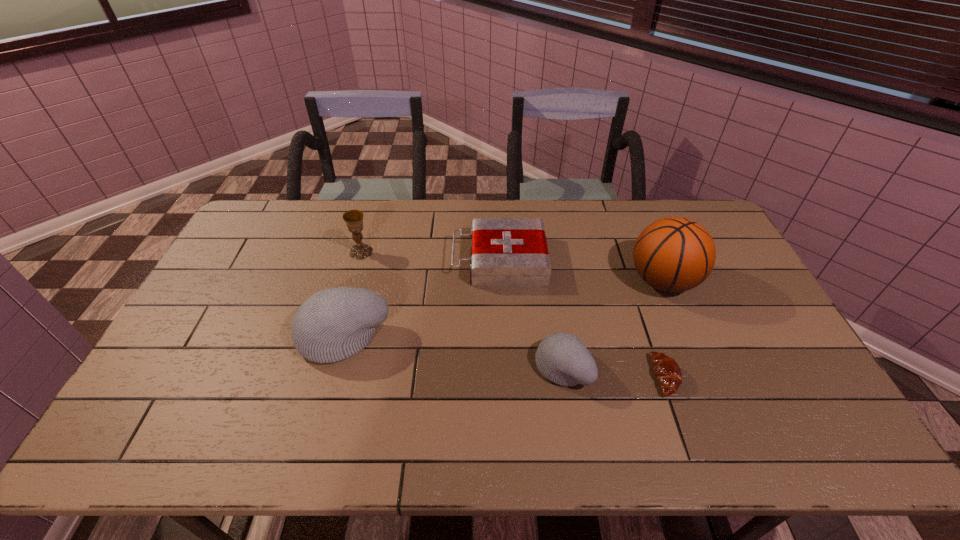
At what (x,y) coordinates should I click in order to perform the action: click on vacant space that's between the chalice and the second shortest object. Please return your answer as a coordinate pair (x, y). This screenshot has height=540, width=960. Looking at the image, I should click on 430,256.

What are the coordinates of `empty space between the taller beanie and the third shortest object` in the screenshot? It's located at (453, 351).

Where is `vacant point located between the second shortest object and the crescent roll`? This screenshot has height=540, width=960. vacant point located between the second shortest object and the crescent roll is located at coordinates (x=583, y=318).

Where is `vacant area that lies between the basketball and the left beanie`? Image resolution: width=960 pixels, height=540 pixels. vacant area that lies between the basketball and the left beanie is located at coordinates (503, 308).

I want to click on free space between the first-aid kit and the crescent roll, so click(x=583, y=318).

Where is `object that stands as the closest to the chalice`? object that stands as the closest to the chalice is located at coordinates (333, 324).

Locate which object is the second closest to the tallest object. Please provide its 2D coordinates. Your answer should be formatted as a tuple, i.e. [(x, y)], where the tuple contains the x and y coordinates of a point satisfying the conditions above.

[(562, 358)]

Find the location of a particular element. This screenshot has height=540, width=960. vacant space that satisfies the following two spatial constraints: 1. on the back side of the tallest object; 2. on the front side of the first-aid kit is located at coordinates (655, 260).

You are a GUI agent. You are given a task and a screenshot of the screen. Output one action in this format:
    pyautogui.click(x=<x>, y=<y>)
    Task: Click on the free location that satisfies the following two spatial constraints: 1. on the back side of the shortest object; 2. on the right side of the tallest object
    
    Given the screenshot: What is the action you would take?
    pyautogui.click(x=633, y=280)

Where is `free space that satisfies the following two spatial constraints: 1. on the front side of the second shortest object; 2. on the right side of the right beanie`? The height and width of the screenshot is (540, 960). free space that satisfies the following two spatial constraints: 1. on the front side of the second shortest object; 2. on the right side of the right beanie is located at coordinates (505, 367).